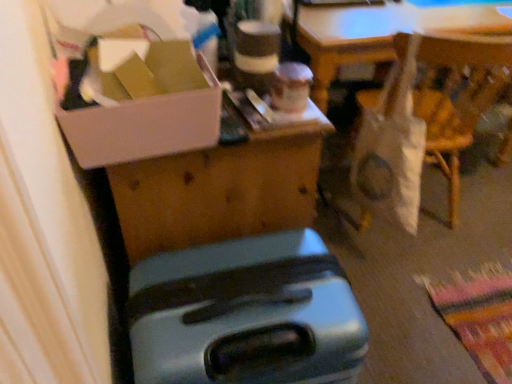
Question: Are white cardboard box at upper left and white fabric bag at right making contact?

Choices:
 (A) yes
 (B) no

Answer: (B)

Question: Is white cardboard box at upper left positioned before white fabric bag at right?

Choices:
 (A) no
 (B) yes

Answer: (B)

Question: Can white fabric bag at right be found inside white cardboard box at upper left?

Choices:
 (A) no
 (B) yes

Answer: (A)

Question: Is white cardboard box at upper left bigger than white fabric bag at right?

Choices:
 (A) yes
 (B) no

Answer: (B)

Question: Is white cardboard box at upper left positioned with its back to white fabric bag at right?

Choices:
 (A) no
 (B) yes

Answer: (A)

Question: Can we say white cardboard box at upper left lies outside white fabric bag at right?

Choices:
 (A) yes
 (B) no

Answer: (A)

Question: Is metallic suitcase at lower center closer to the viewer compared to white fabric bag at right?

Choices:
 (A) no
 (B) yes

Answer: (B)

Question: Does metallic suitcase at lower center have a greater height compared to white fabric bag at right?

Choices:
 (A) yes
 (B) no

Answer: (B)

Question: Is metallic suitcase at lower center oriented away from white fabric bag at right?

Choices:
 (A) no
 (B) yes

Answer: (A)

Question: Is metallic suitcase at lower center located outside white fabric bag at right?

Choices:
 (A) yes
 (B) no

Answer: (A)

Question: From the image's perspective, is metallic suitcase at lower center below white fabric bag at right?

Choices:
 (A) no
 (B) yes

Answer: (B)

Question: Is metallic suitcase at lower center not near white fabric bag at right?

Choices:
 (A) yes
 (B) no

Answer: (B)

Question: Does white cardboard box at upper left have a lesser width compared to metallic suitcase at lower center?

Choices:
 (A) yes
 (B) no

Answer: (A)